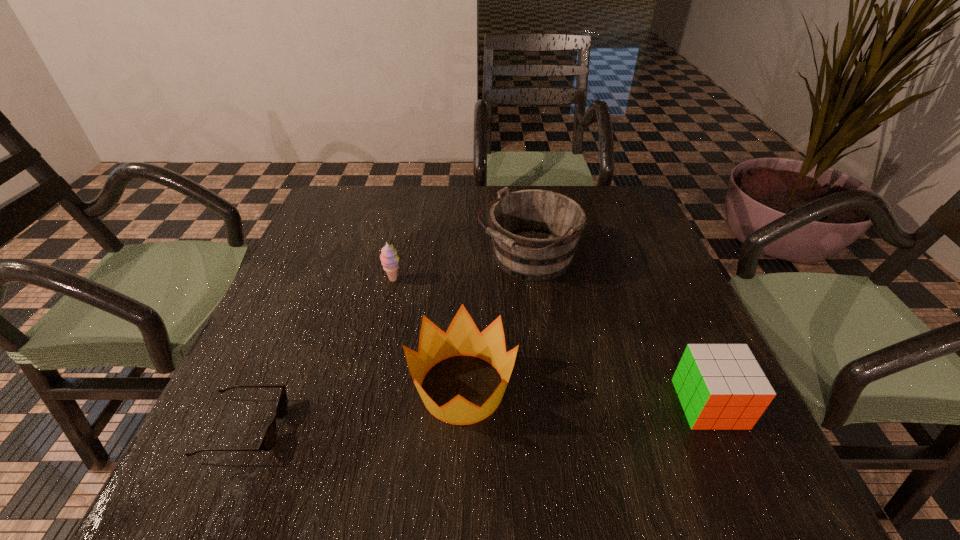
The image size is (960, 540). What are the coordinates of `wine bucket` in the screenshot? It's located at (535, 233).

Locate an element on the screen. The height and width of the screenshot is (540, 960). crown is located at coordinates (462, 337).

Locate an element on the screen. The width and height of the screenshot is (960, 540). the second object from left to right is located at coordinates (389, 259).

I want to click on cube, so click(720, 386).

At what (x,y) coordinates should I click in order to perform the action: click on sunglasses. Please return your answer as a coordinate pair (x, y). The image size is (960, 540). Looking at the image, I should click on (269, 438).

Where is `the leftmost object`? The width and height of the screenshot is (960, 540). the leftmost object is located at coordinates (269, 438).

You are a GUI agent. You are given a task and a screenshot of the screen. Output one action in this format:
    pyautogui.click(x=<x>, y=<y>)
    Task: Click on the blank space located 0.130m on the right of the tallest object
    The height and width of the screenshot is (540, 960).
    Given the screenshot: What is the action you would take?
    pyautogui.click(x=632, y=259)

The image size is (960, 540). Identify the location of vacant area situated 0.330m on the left of the crown. (229, 388).

Find the location of a particular element. vacant space situated on the back of the second object from left to right is located at coordinates [x=408, y=214].

This screenshot has height=540, width=960. I want to click on free space located on the back of the rightmost object, so click(685, 350).